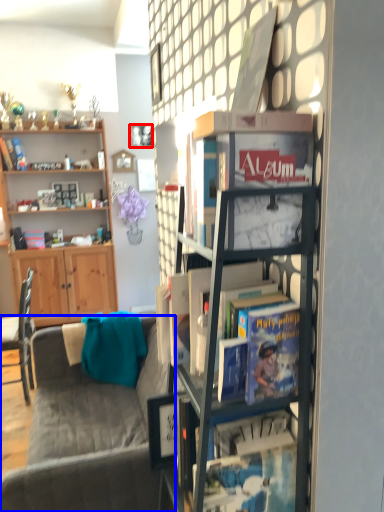
Question: Among these objects, which one is farthest to the camera, picture frame (highlighted by a red box) or studio couch (highlighted by a blue box)?

Choices:
 (A) picture frame
 (B) studio couch

Answer: (A)